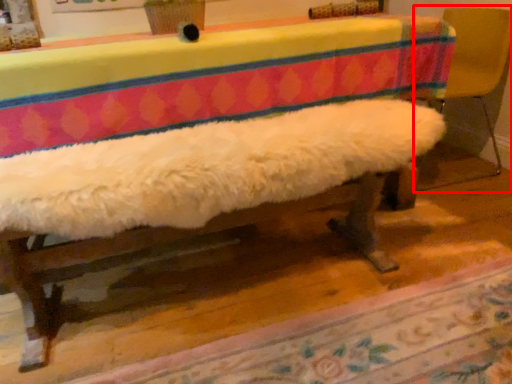
Question: From the image's perspective, where is armchair (annotated by the red box) located in relation to mat in the image?

Choices:
 (A) above
 (B) below

Answer: (A)